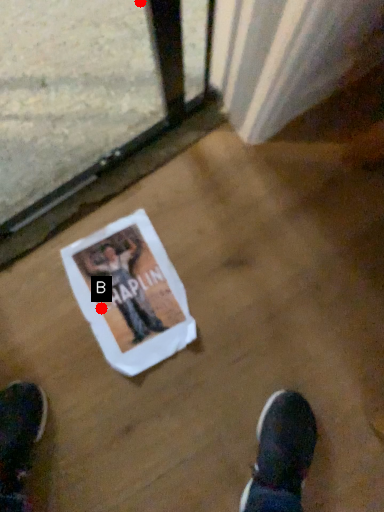
Question: Two points are circled on the image, labeled by A and B beside each circle. Which point is farther from the camera taking this photo?

Choices:
 (A) A is further
 (B) B is further

Answer: (B)